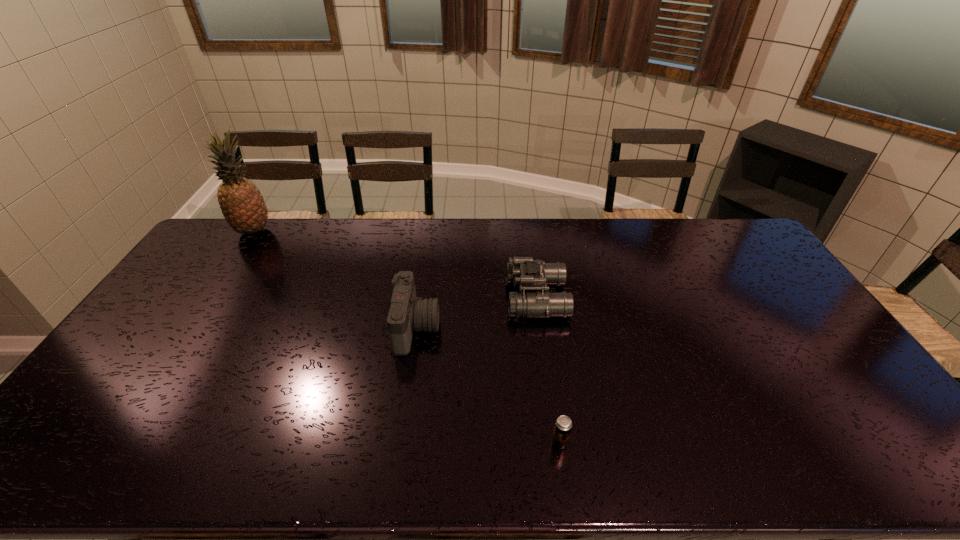
Identify the location of blank space at the far right corner of the desktop. Image resolution: width=960 pixels, height=540 pixels. (732, 225).

Find the location of `free spot between the binoculars and the leftmost object`. free spot between the binoculars and the leftmost object is located at coordinates (396, 265).

Where is `empty space between the camera and the nearest object`? The height and width of the screenshot is (540, 960). empty space between the camera and the nearest object is located at coordinates (489, 385).

The width and height of the screenshot is (960, 540). Find the location of `vacant space that is in between the nearest object and the binoculars`. vacant space that is in between the nearest object and the binoculars is located at coordinates (x=548, y=370).

You are a GUI agent. You are given a task and a screenshot of the screen. Output one action in this format:
    pyautogui.click(x=<x>, y=<y>)
    Task: Click on the vacant area that lies between the nearest object and the binoculars
    This screenshot has width=960, height=540.
    Given the screenshot: What is the action you would take?
    pyautogui.click(x=548, y=370)

I want to click on unoccupied area between the pineapple and the binoculars, so click(396, 265).

Locate an element on the screen. This screenshot has width=960, height=540. vacant area that lies between the second object from left to right and the binoculars is located at coordinates (477, 313).

Locate an element on the screen. The image size is (960, 540). free space between the binoculars and the farthest object is located at coordinates (396, 265).

Where is `free spot between the camera and the leftmost object`? free spot between the camera and the leftmost object is located at coordinates (335, 279).

The image size is (960, 540). Find the location of `free space between the binoculars and the farthest object`. free space between the binoculars and the farthest object is located at coordinates (396, 265).